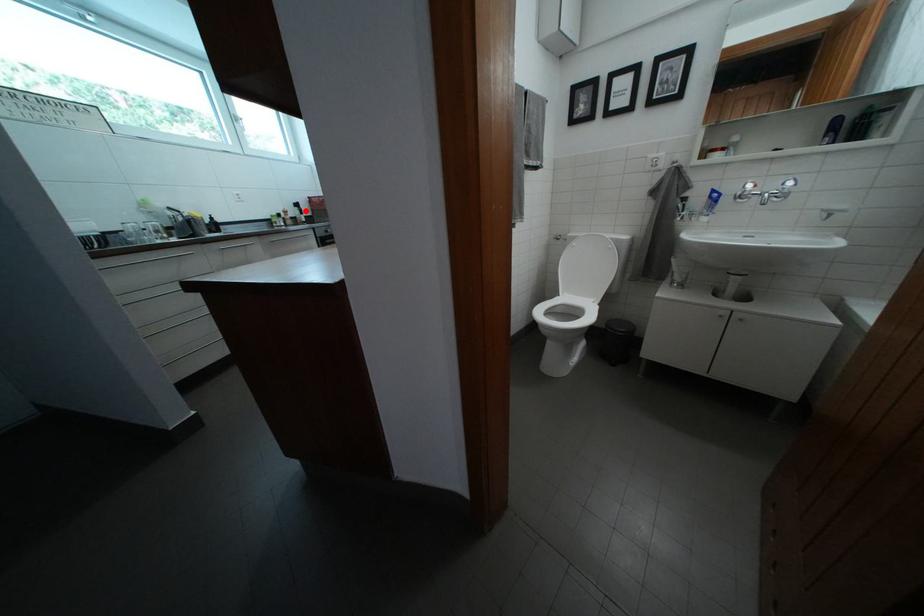
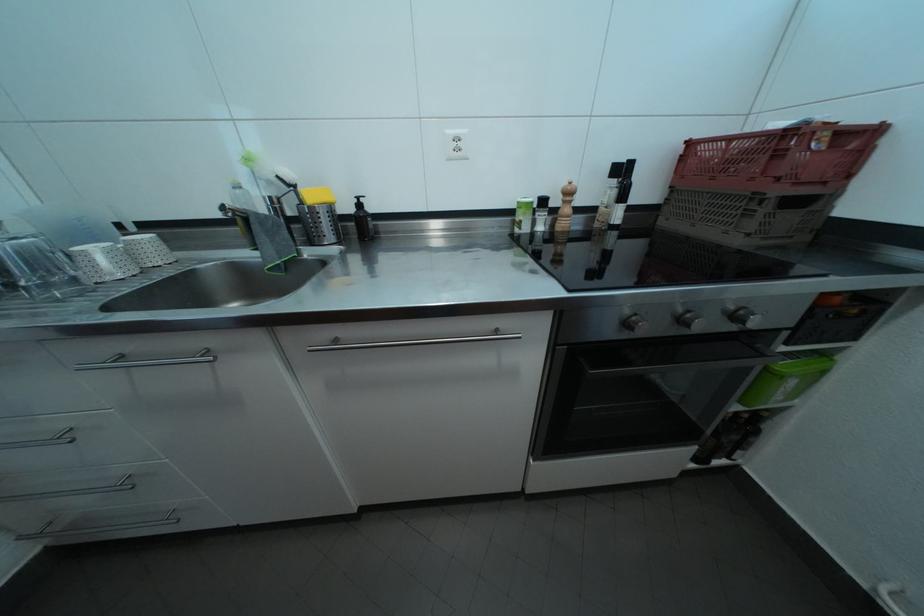
Question: I am providing you with two images of the same scene from different viewpoints. Given a red point in image1, look at the same physical point in image2. Is it:

Choices:
 (A) Closer to the viewpoint
 (B) Farther from the viewpoint

Answer: (B)